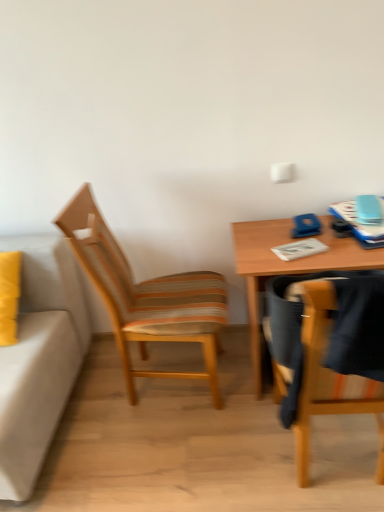
Question: Is wooden chair at right, the first chair positioned from the front, not near white paper notepad at center?

Choices:
 (A) no
 (B) yes

Answer: (A)

Question: Is wooden chair at right, which is the 2th chair in left-to-right order, looking in the opposite direction of white paper notepad at center?

Choices:
 (A) yes
 (B) no

Answer: (B)

Question: From a real-world perspective, is wooden chair at right, arranged as the 2th chair when viewed from the back, positioned under white paper notepad at center based on gravity?

Choices:
 (A) yes
 (B) no

Answer: (A)

Question: Does wooden chair at right, which is the first chair from right to left, have a smaller size compared to white paper notepad at center?

Choices:
 (A) no
 (B) yes

Answer: (A)

Question: Can you confirm if wooden chair at right, which is the first chair from right to left, is positioned to the left of white paper notepad at center?

Choices:
 (A) no
 (B) yes

Answer: (B)

Question: From their relative heights in the image, would you say woodenchair at left, which is the second chair in front-to-back order, is taller or shorter than white paper notepad at center?

Choices:
 (A) short
 (B) tall

Answer: (B)

Question: In the image, is woodenchair at left, positioned as the second chair in right-to-left order, positioned in front of or behind white paper notepad at center?

Choices:
 (A) behind
 (B) front

Answer: (B)

Question: Is woodenchair at left, which is the second chair in front-to-back order, spatially inside white paper notepad at center, or outside of it?

Choices:
 (A) outside
 (B) inside

Answer: (A)

Question: Based on their positions, is woodenchair at left, which appears as the first chair when viewed from the left, located to the left or right of white paper notepad at center?

Choices:
 (A) left
 (B) right

Answer: (A)

Question: Is wooden table at right spatially inside wooden chair at right, arranged as the 2th chair when viewed from the back, or outside of it?

Choices:
 (A) inside
 (B) outside

Answer: (B)

Question: In the image, is wooden table at right positioned in front of or behind wooden chair at right, arranged as the 2th chair when viewed from the back?

Choices:
 (A) front
 (B) behind

Answer: (B)

Question: Considering the positions of point 279,270 and point 304,454, is point 279,270 closer or farther from the camera than point 304,454?

Choices:
 (A) closer
 (B) farther

Answer: (B)

Question: Would you say wooden table at right is to the left or to the right of wooden chair at right, which is the 2th chair in left-to-right order, in the picture?

Choices:
 (A) right
 (B) left

Answer: (A)

Question: Based on their positions, is white paper notepad at center located to the left or right of woodenchair at left, which appears as the first chair when viewed from the left?

Choices:
 (A) left
 (B) right

Answer: (B)

Question: Based on their sizes in the image, would you say white paper notepad at center is bigger or smaller than woodenchair at left, which appears as the first chair when viewed from the left?

Choices:
 (A) small
 (B) big

Answer: (A)